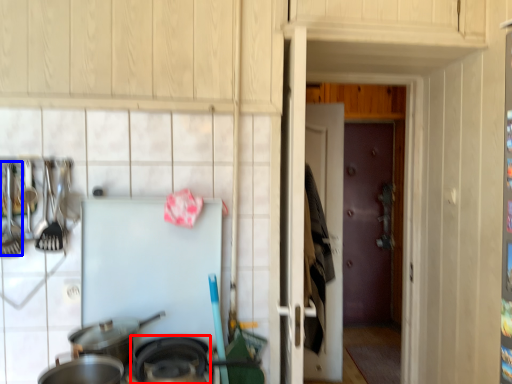
Question: Which point is further to the camera, wok (highlighted by a red box) or silverware (highlighted by a blue box)?

Choices:
 (A) wok
 (B) silverware

Answer: (B)